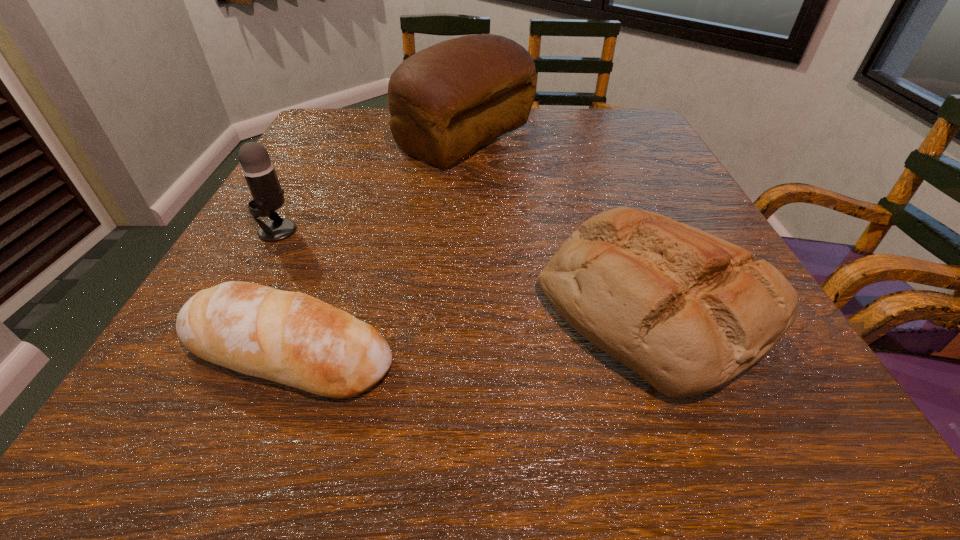
Find the location of a particular element. This screenshot has width=960, height=540. the farthest bread is located at coordinates (445, 101).

This screenshot has width=960, height=540. I want to click on the tallest bread, so [x=445, y=101].

Where is `microphone`? This screenshot has width=960, height=540. microphone is located at coordinates pos(259,172).

At what (x,y) coordinates should I click in order to perform the action: click on the second shortest bread. Please return your answer as a coordinate pair (x, y). Looking at the image, I should click on (687, 311).

Locate an element on the screen. This screenshot has width=960, height=540. the shortest object is located at coordinates (292, 338).

Find the location of a particular element. vacant region located 0.130m on the left of the tallest bread is located at coordinates (345, 138).

You are a GUI agent. You are given a task and a screenshot of the screen. Output one action in this format:
    pyautogui.click(x=<x>, y=<y>)
    Task: Click on the vacant space situated 0.380m on the back of the microphone
    
    Given the screenshot: What is the action you would take?
    pyautogui.click(x=332, y=131)

You are a GUI agent. You are given a task and a screenshot of the screen. Output one action in this format:
    pyautogui.click(x=<x>, y=<y>)
    Task: Click on the vacant space located 0.140m on the left of the second shortest bread
    Image resolution: width=960 pixels, height=540 pixels.
    Given the screenshot: What is the action you would take?
    pyautogui.click(x=447, y=307)

Locate an element on the screen. The height and width of the screenshot is (540, 960). vacant space located on the right of the shortest bread is located at coordinates coord(598,351).

Where is `object present at the far edge`? object present at the far edge is located at coordinates (445, 101).